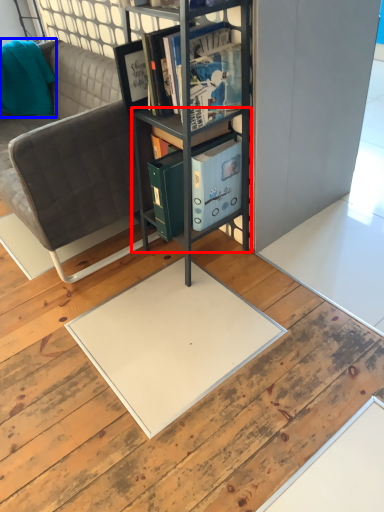
Question: Which of the following is the farthest to the observer, cabinet (highlighted by a red box) or pillow (highlighted by a blue box)?

Choices:
 (A) cabinet
 (B) pillow

Answer: (B)